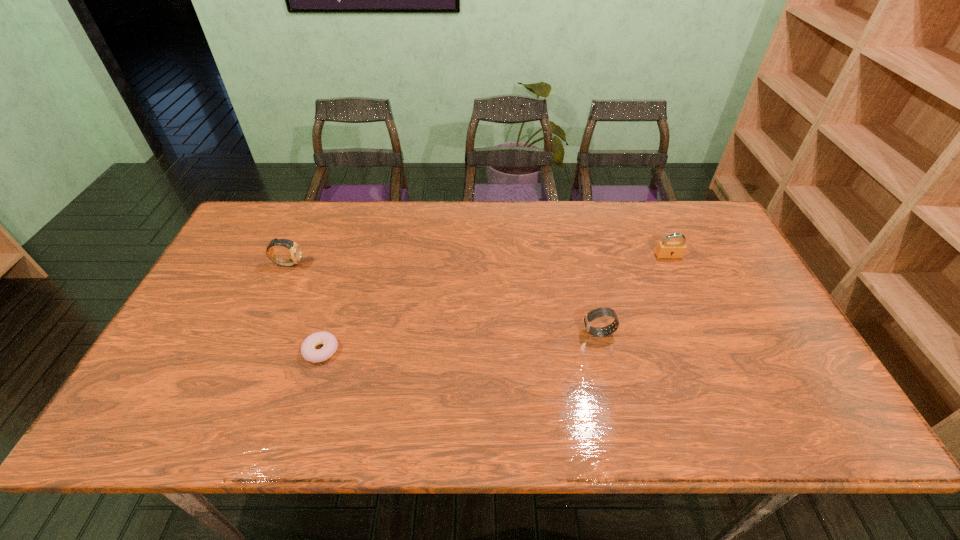
This screenshot has width=960, height=540. I want to click on the leftmost object, so click(x=295, y=249).

I want to click on the left watch, so click(295, 249).

The image size is (960, 540). I want to click on padlock, so click(x=665, y=249).

Locate an element on the screen. The height and width of the screenshot is (540, 960). the nearer watch is located at coordinates (602, 311).

Identify the location of the second object from right to left. click(602, 311).

Where is `the second object from left to right`? This screenshot has width=960, height=540. the second object from left to right is located at coordinates (308, 351).

I want to click on doughnut, so click(308, 351).

Identify the location of vacant region located on the face of the left watch. The height and width of the screenshot is (540, 960). tap(349, 264).

Image resolution: width=960 pixels, height=540 pixels. Identify the location of vacant space located 0.380m to unlock the rightmost object from the front. (717, 365).

Image resolution: width=960 pixels, height=540 pixels. What are the coordinates of `vacant area situated 0.050m on the face of the third object from left to right` in the screenshot? It's located at (564, 333).